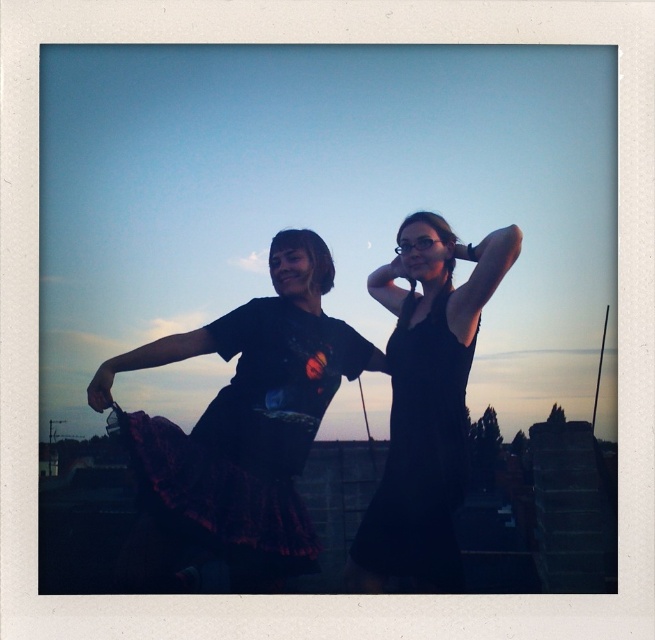
Is black satin dress at center further to camera compared to black matte dress at center?

That is True.

Between point (278, 518) and point (440, 356), which one is positioned behind?

The point (440, 356) is behind.

Locate an element on the screen. This screenshot has height=640, width=655. black satin dress at center is located at coordinates (248, 440).

Where is `black satin dress at center`? black satin dress at center is located at coordinates (248, 440).